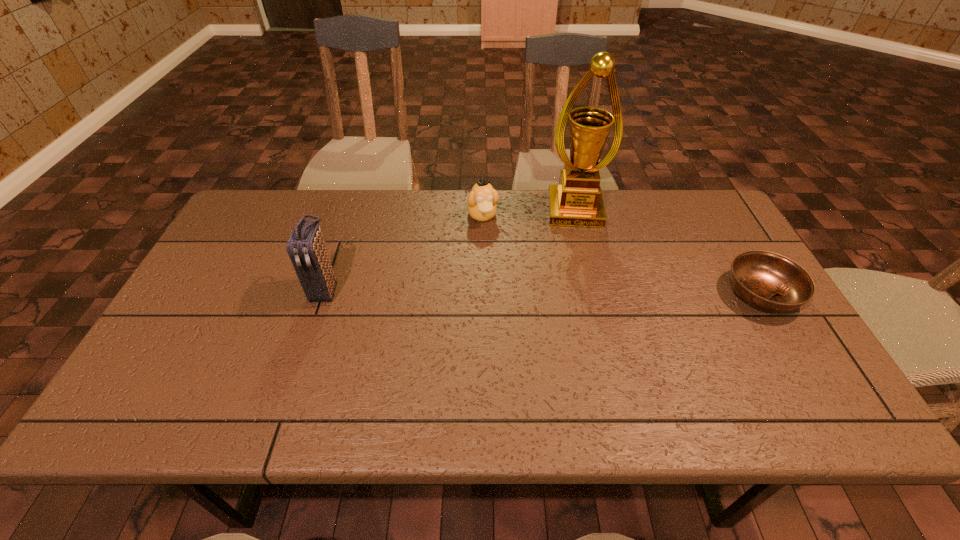
The height and width of the screenshot is (540, 960). Find the location of `vacant spot on the desktop that is between the leftmost object and the rightmost object and is positioned on the face of the third object from right to left`. vacant spot on the desktop that is between the leftmost object and the rightmost object and is positioned on the face of the third object from right to left is located at coordinates (506, 291).

You are a GUI agent. You are given a task and a screenshot of the screen. Output one action in this format:
    pyautogui.click(x=<x>, y=<y>)
    Task: Click on the free space on the desktop that is between the leftmost object and the rightmost object and is positioned on the front-facing side of the second object from right to left
    
    Given the screenshot: What is the action you would take?
    pyautogui.click(x=584, y=292)